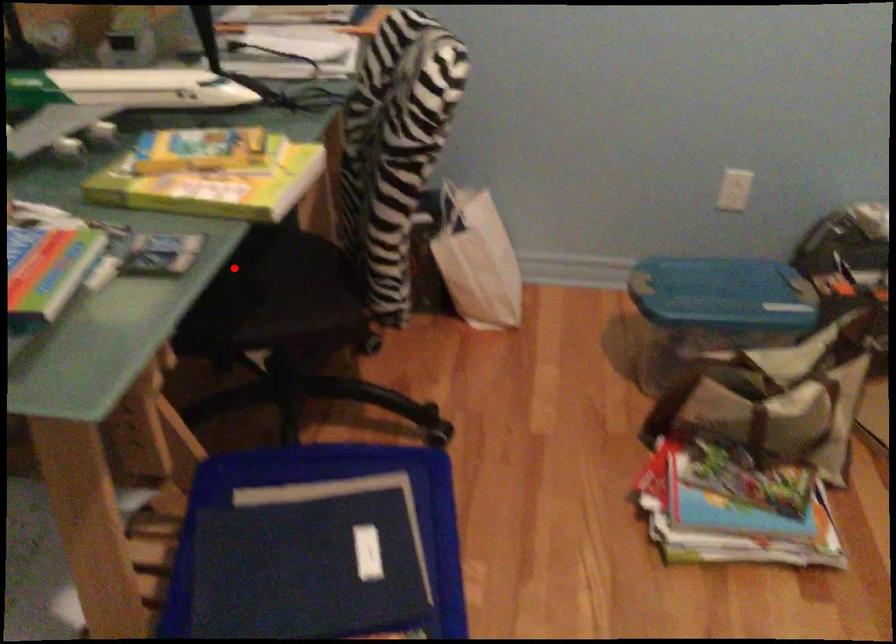
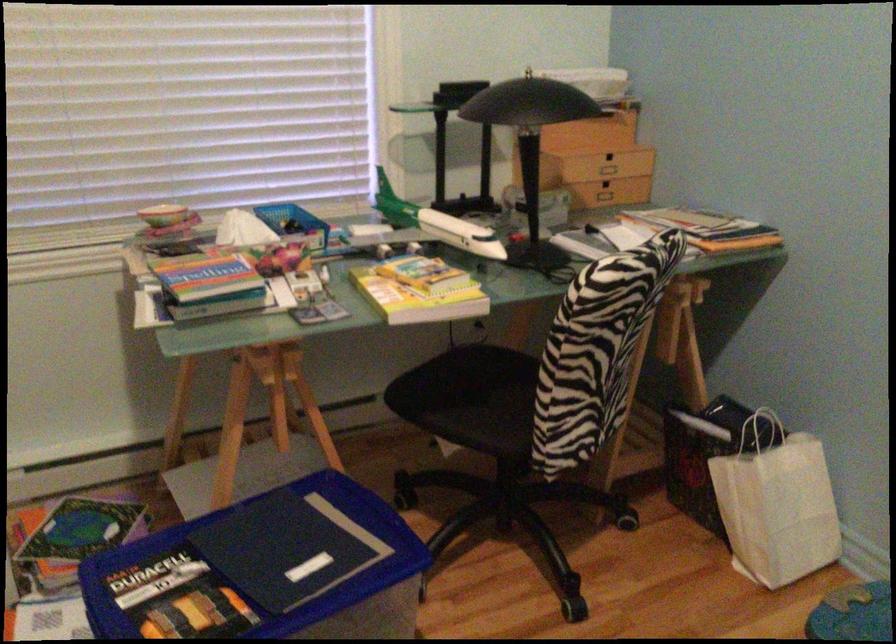
The point at the highlighted location is marked in the first image. Where is the corresponding point in the second image?

(487, 377)